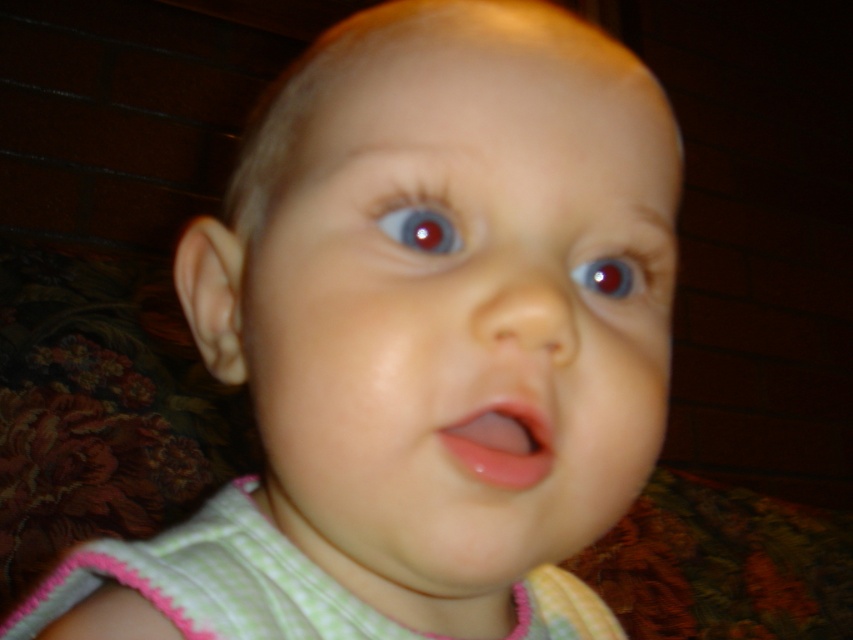
Question: Is smooth skin baby at center below shiny blue eye at center?

Choices:
 (A) no
 (B) yes

Answer: (B)

Question: In this image, where is pink glossy lips at center located relative to glossy red eye at upper center?

Choices:
 (A) right
 (B) left

Answer: (B)

Question: Which object is positioned closest to the shiny blue eye at center?

Choices:
 (A) smooth skin baby at center
 (B) glossy red eye at upper center
 (C) pink glossy lips at center

Answer: (C)

Question: Which object is positioned closest to the glossy red eye at upper center?

Choices:
 (A) smooth skin baby at center
 (B) shiny blue eye at center

Answer: (B)

Question: Is smooth skin baby at center wider than pink glossy lips at center?

Choices:
 (A) yes
 (B) no

Answer: (A)

Question: Which point appears farthest from the camera in this image?

Choices:
 (A) (605, 280)
 (B) (308, 486)

Answer: (A)